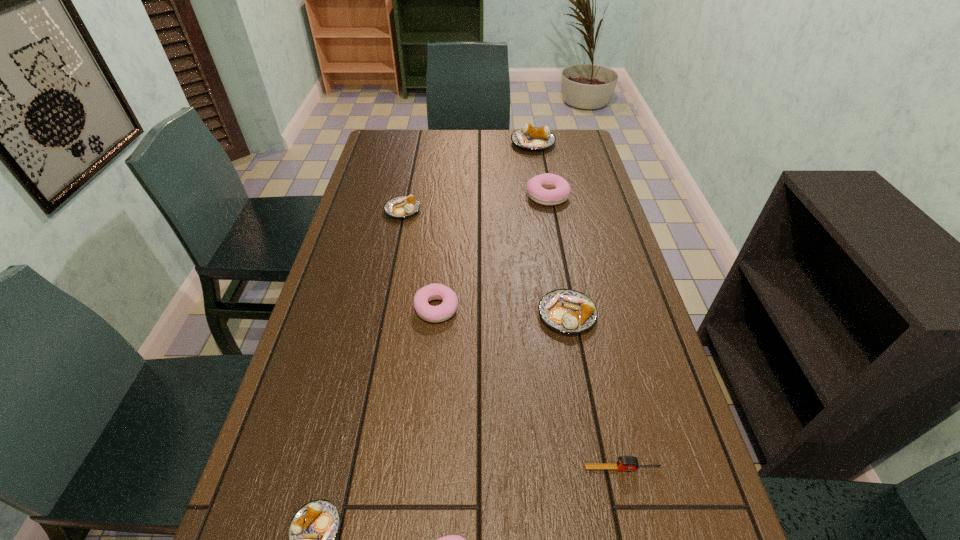
Identify the location of the biggest brown pastry. (531, 138).

Locate an element on the screen. This screenshot has width=960, height=540. the farthest pastry is located at coordinates (531, 138).

Find the location of a particular element. the farthest pink pastry is located at coordinates (537, 187).

I want to click on the rightmost pink pastry, so click(x=537, y=187).

You are a GUI agent. You are given a task and a screenshot of the screen. Output one action in this format:
    pyautogui.click(x=<x>, y=<y>)
    Task: Click on the third smallest brown pastry
    The height and width of the screenshot is (540, 960).
    Given the screenshot: What is the action you would take?
    pyautogui.click(x=568, y=311)

At what (x,y) coordinates should I click in order to perform the action: click on the second farthest pink pastry. Please return your answer as a coordinate pair (x, y). The image size is (960, 540). Looking at the image, I should click on (444, 311).

I want to click on the second farthest brown pastry, so click(401, 206).

Where is `tape measure`? This screenshot has height=540, width=960. tape measure is located at coordinates (625, 463).

At what (x,y) coordinates should I click in order to perform the action: click on the third nearest object. Please return your answer as a coordinate pair (x, y). Looking at the image, I should click on (625, 463).

Where is `blank area located on the right of the farthest pastry`? blank area located on the right of the farthest pastry is located at coordinates (577, 143).